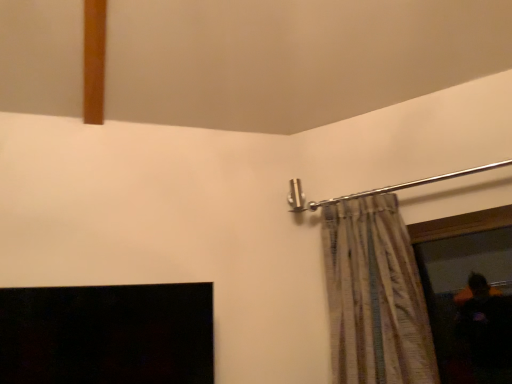
Question: Is striped fabric curtain at upper right oriented away from clear glass window screen at right?

Choices:
 (A) yes
 (B) no

Answer: (B)

Question: From the image's perspective, is striped fabric curtain at upper right below clear glass window screen at right?

Choices:
 (A) yes
 (B) no

Answer: (B)

Question: Is striped fabric curtain at upper right closer to camera compared to clear glass window screen at right?

Choices:
 (A) no
 (B) yes

Answer: (B)

Question: Can you confirm if striped fabric curtain at upper right is taller than clear glass window screen at right?

Choices:
 (A) yes
 (B) no

Answer: (A)

Question: Considering the relative sizes of striped fabric curtain at upper right and clear glass window screen at right in the image provided, is striped fabric curtain at upper right shorter than clear glass window screen at right?

Choices:
 (A) yes
 (B) no

Answer: (B)

Question: Does striped fabric curtain at upper right have a lesser width compared to clear glass window screen at right?

Choices:
 (A) no
 (B) yes

Answer: (A)

Question: Is clear glass window screen at right to the right of striped fabric curtain at upper right from the viewer's perspective?

Choices:
 (A) no
 (B) yes

Answer: (B)

Question: Is clear glass window screen at right behind striped fabric curtain at upper right?

Choices:
 (A) no
 (B) yes

Answer: (B)

Question: Can you confirm if clear glass window screen at right is taller than striped fabric curtain at upper right?

Choices:
 (A) no
 (B) yes

Answer: (A)

Question: From a real-world perspective, is clear glass window screen at right positioned under striped fabric curtain at upper right based on gravity?

Choices:
 (A) yes
 (B) no

Answer: (A)

Question: Can you confirm if clear glass window screen at right is smaller than striped fabric curtain at upper right?

Choices:
 (A) yes
 (B) no

Answer: (A)

Question: Would you say clear glass window screen at right contains striped fabric curtain at upper right?

Choices:
 (A) no
 (B) yes

Answer: (A)

Question: From a real-world perspective, is striped fabric curtain at upper right above or below clear glass window screen at right?

Choices:
 (A) below
 (B) above

Answer: (B)